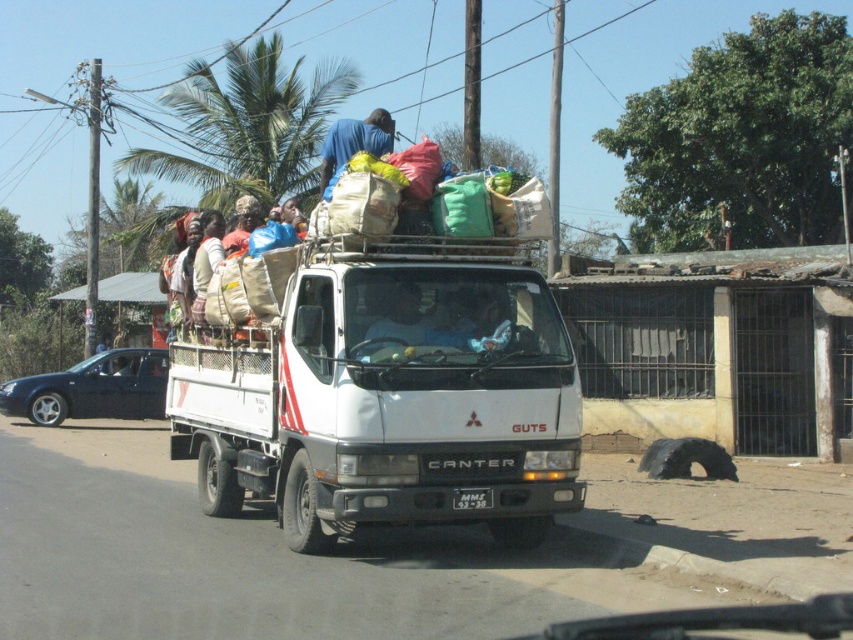
Question: Among these objects, which one is farthest from the camera?

Choices:
 (A) matte black sedan at left
 (B) blue fabric bag at upper center

Answer: (A)

Question: Is green leafy palm tree at upper center bigger than blue fabric shirt at center?

Choices:
 (A) no
 (B) yes

Answer: (B)

Question: Does brown woven basket at upper center appear over black plastic license plate at center?

Choices:
 (A) yes
 (B) no

Answer: (A)

Question: Can you confirm if white matte truck at center is positioned to the right of matte black sedan at left?

Choices:
 (A) yes
 (B) no

Answer: (A)

Question: Which object is positioned closest to the blue fabric bag at upper center?

Choices:
 (A) black plastic license plate at center
 (B) green leafy palm tree at upper center

Answer: (A)

Question: Among these objects, which one is nearest to the camera?

Choices:
 (A) black plastic license plate at center
 (B) brown woven basket at upper center

Answer: (A)